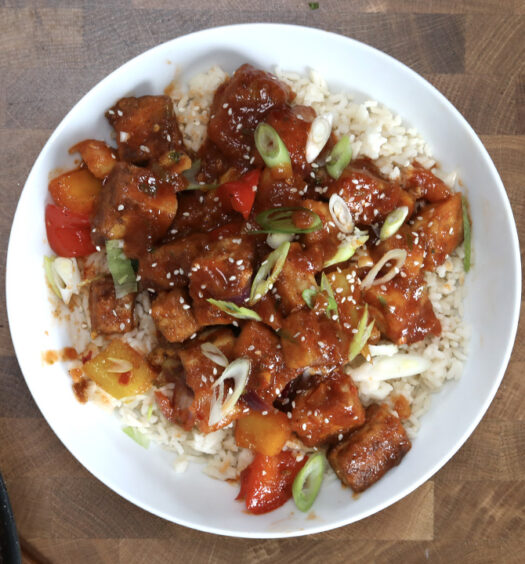
Locate an element on the screen. plate is located at coordinates (450, 411).